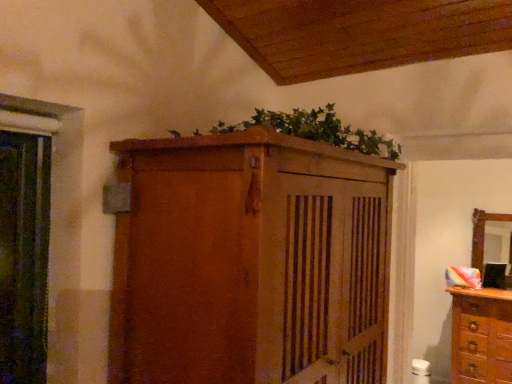
Question: Is wooden mirror at right bigger or smaller than matte wooden cupboard at upper center?

Choices:
 (A) big
 (B) small

Answer: (B)

Question: From the image's perspective, relative to matte wooden cupboard at upper center, is wooden mirror at right above or below?

Choices:
 (A) below
 (B) above

Answer: (A)

Question: Which of these objects is positioned closest to the wooden dresser at right?

Choices:
 (A) green leafy plant at upper center
 (B) wooden mirror at right
 (C) matte wooden cupboard at upper center

Answer: (B)

Question: Estimate the real-world distances between objects in this image. Which object is farther from the matte wooden cupboard at upper center?

Choices:
 (A) wooden dresser at right
 (B) wooden mirror at right
 (C) green leafy plant at upper center

Answer: (B)